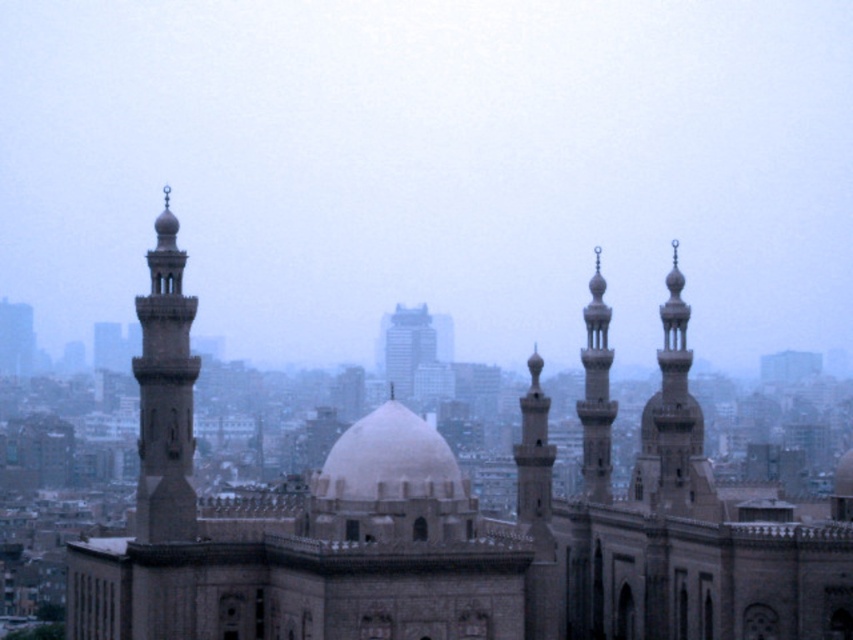
You are an architect analyzing the cityscape. You notice the smooth stone minaret at center and the white glass skyscraper at center. Which of these two structures is taller?

The smooth stone minaret at center is much taller than the white glass skyscraper at center.

You are an architect evaluating the height of two structures in the cityscape. Which one is taller between the smooth stone minaret at upper right and the white glass skyscraper at center?

The smooth stone minaret at upper right is taller than the white glass skyscraper at center according to the description.